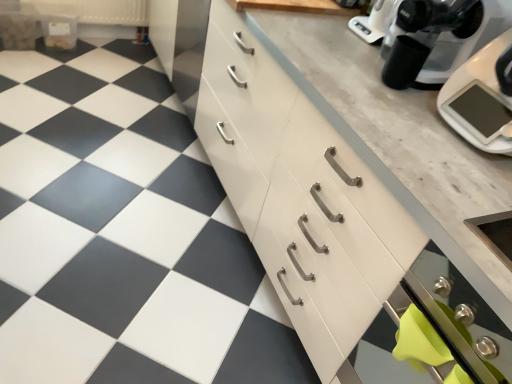
Question: Relative to stainless steel oven at lower right, is white glossy kitchen scale at upper right in front or behind?

Choices:
 (A) front
 (B) behind

Answer: (B)

Question: From a real-world perspective, is white glossy kitchen scale at upper right positioned above or below stainless steel oven at lower right?

Choices:
 (A) above
 (B) below

Answer: (A)

Question: Which object is the closest to the white glossy tile at center?

Choices:
 (A) black plastic coffee maker at upper right
 (B) white glossy cabinet at upper right, acting as the 2th cabinetry starting from the front
 (C) white wood cabinet at center, the 2th cabinetry from the back
 (D) white glossy kitchen scale at upper right
 (E) stainless steel oven at lower right

Answer: (C)

Question: Estimate the real-world distances between objects in this image. Which object is closer to the white glossy kitchen scale at upper right?

Choices:
 (A) black plastic coffee maker at upper right
 (B) white wood cabinet at center, the 2th cabinetry from the back
 (C) stainless steel oven at lower right
 (D) white glossy cabinet at upper right, placed as the 1th cabinetry when sorted from top to bottom
 (E) white glossy tile at center

Answer: (A)